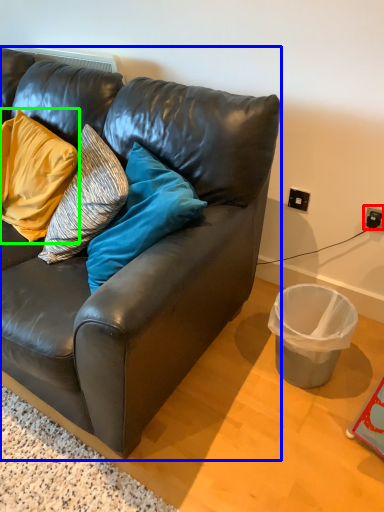
Question: Based on their relative distances, which object is nearer to power outlet (highlighted by a red box)? Choose from studio couch (highlighted by a blue box) and pillow (highlighted by a green box).

Choices:
 (A) studio couch
 (B) pillow

Answer: (A)